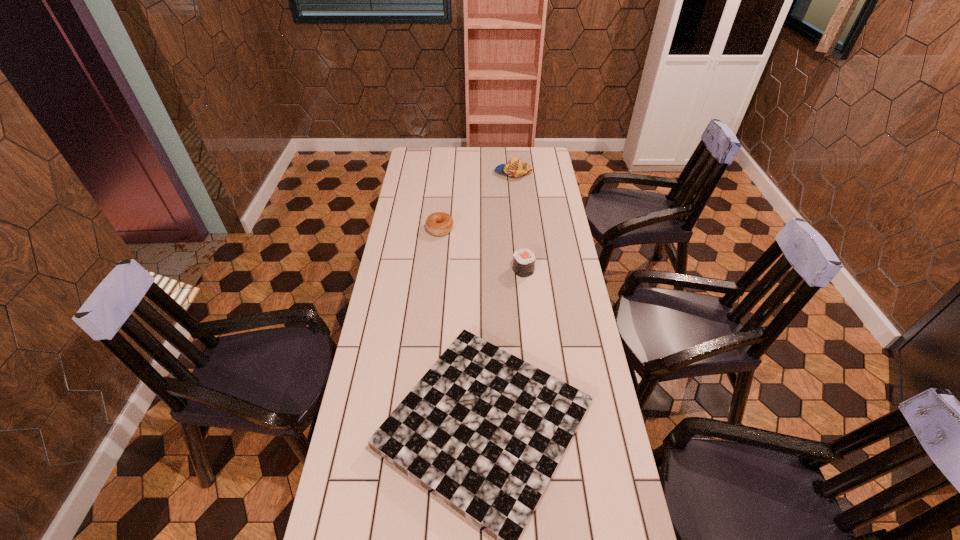
Where is `the third farthest object`? The height and width of the screenshot is (540, 960). the third farthest object is located at coordinates (523, 260).

Where is `the farthest object`? the farthest object is located at coordinates (515, 167).

Where is `the third tallest object`? This screenshot has width=960, height=540. the third tallest object is located at coordinates (439, 223).

I want to click on bagel, so click(439, 223).

Find the location of a particular element. The width and height of the screenshot is (960, 540). free location located 0.340m on the back of the sushi is located at coordinates (517, 212).

The width and height of the screenshot is (960, 540). Identify the location of blank area located 0.360m on the bill of the cap. (424, 172).

Find the location of a particular element. This screenshot has width=960, height=540. vacant space situated 0.370m on the bill of the cap is located at coordinates (422, 172).

What are the coordinates of `vacant space located on the bill of the cap` in the screenshot? It's located at (462, 172).

This screenshot has width=960, height=540. Find the location of `blank space located 0.160m on the back of the third nearest object`. blank space located 0.160m on the back of the third nearest object is located at coordinates (443, 199).

This screenshot has height=540, width=960. What are the coordinates of `object that is at the far edge` in the screenshot? It's located at (515, 167).